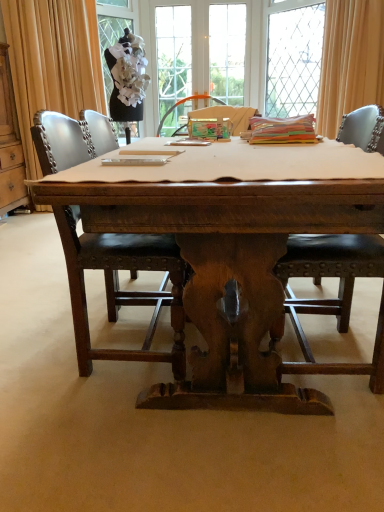
Question: Is beige fabric curtain at upper right, which is the 2th curtain from left to right, positioned beyond the bounds of wooden cabinet at left?

Choices:
 (A) yes
 (B) no

Answer: (A)

Question: Is beige fabric curtain at upper right, which is the 2th curtain from left to right, thinner than wooden cabinet at left?

Choices:
 (A) no
 (B) yes

Answer: (A)

Question: Can you confirm if beige fabric curtain at upper right, which is the 2th curtain from left to right, is taller than wooden cabinet at left?

Choices:
 (A) no
 (B) yes

Answer: (A)

Question: Does beige fabric curtain at upper right, which is the 2th curtain from left to right, appear on the right side of wooden cabinet at left?

Choices:
 (A) no
 (B) yes

Answer: (B)

Question: Is beige fabric curtain at upper right, arranged as the first curtain when viewed from the right, not close to wooden cabinet at left?

Choices:
 (A) no
 (B) yes

Answer: (B)

Question: Does beige fabric curtain at upper right, which is the 2th curtain from left to right, turn towards wooden cabinet at left?

Choices:
 (A) yes
 (B) no

Answer: (B)

Question: Is black leather chair at center, which ranks as the 1th chair in right-to-left order, positioned with its back to clear glass window at upper center, the second window in the left-to-right sequence?

Choices:
 (A) no
 (B) yes

Answer: (A)

Question: Considering the relative sizes of black leather chair at center, which ranks as the 1th chair in right-to-left order, and clear glass window at upper center, which is the second window in right-to-left order, in the image provided, is black leather chair at center, which ranks as the 1th chair in right-to-left order, wider than clear glass window at upper center, which is the second window in right-to-left order,?

Choices:
 (A) no
 (B) yes

Answer: (B)

Question: From the image's perspective, would you say black leather chair at center, which ranks as the 1th chair in right-to-left order, is shown under clear glass window at upper center, which is the second window in right-to-left order?

Choices:
 (A) no
 (B) yes

Answer: (B)

Question: Does black leather chair at center, which ranks as the 1th chair in right-to-left order, have a smaller size compared to clear glass window at upper center, the second window in the left-to-right sequence?

Choices:
 (A) no
 (B) yes

Answer: (A)

Question: Could you tell me if black leather chair at center, which ranks as the 1th chair in right-to-left order, is facing clear glass window at upper center, which is the second window in right-to-left order?

Choices:
 (A) no
 (B) yes

Answer: (A)

Question: From a real-world perspective, is black leather chair at center, the second chair in the left-to-right sequence, over clear glass window at upper center, which is the second window in right-to-left order?

Choices:
 (A) no
 (B) yes

Answer: (A)

Question: Does white matte tablecloth at center have a lesser height compared to wooden desk at center?

Choices:
 (A) no
 (B) yes

Answer: (B)